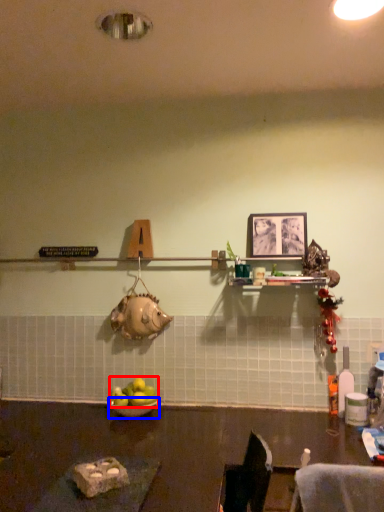
Question: Which of the following is the closest to the observer, apple (highlighted by a red box) or bowl (highlighted by a blue box)?

Choices:
 (A) apple
 (B) bowl

Answer: (B)